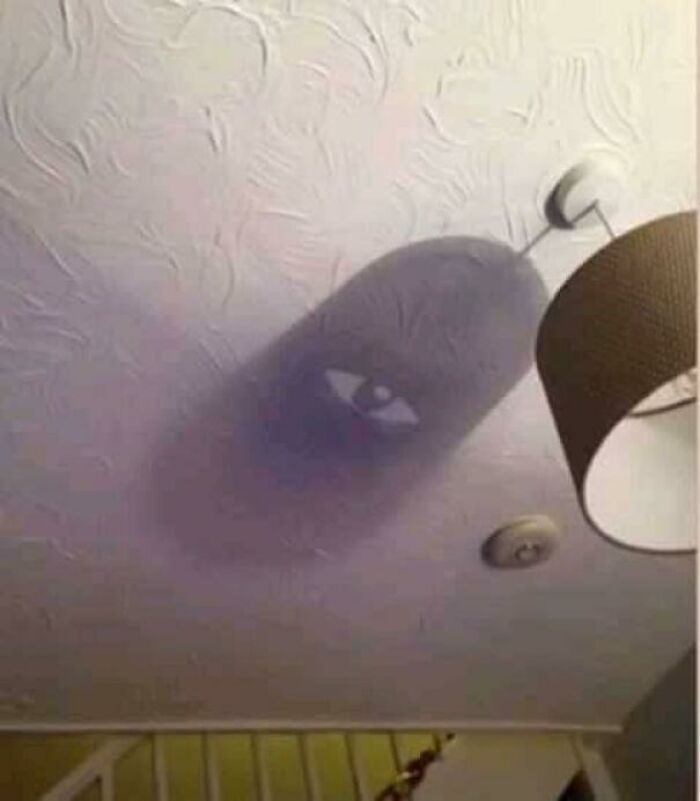
The height and width of the screenshot is (801, 700). In order to click on ceiling in this screenshot , I will do pyautogui.click(x=409, y=561).